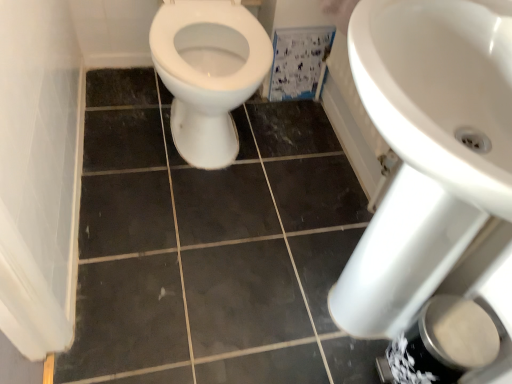
Image resolution: width=512 pixels, height=384 pixels. I want to click on white glossy toilet at center, so coord(208,73).

Describe the element at coordinates (208, 73) in the screenshot. I see `white glossy toilet at center` at that location.

The height and width of the screenshot is (384, 512). I want to click on white glossy toilet at center, so click(x=208, y=73).